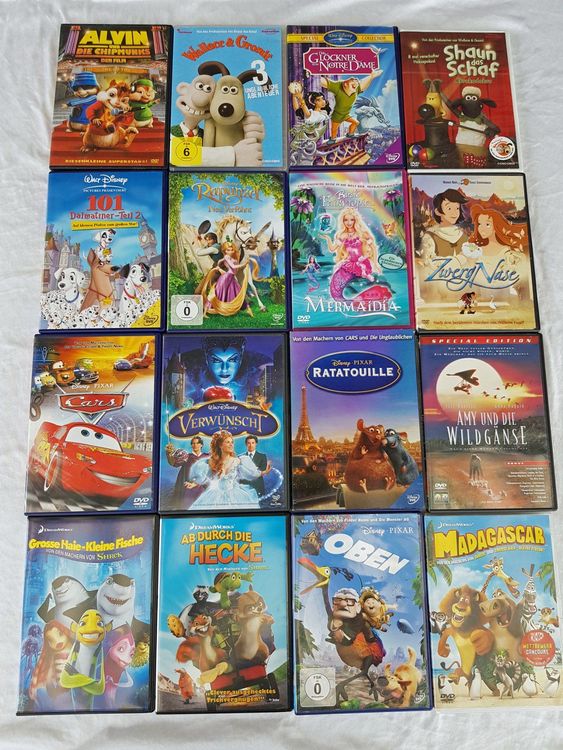
Find the location of a particular element. The image size is (563, 750). third row of dvds is located at coordinates (468, 423), (365, 423), (223, 422), (106, 434).